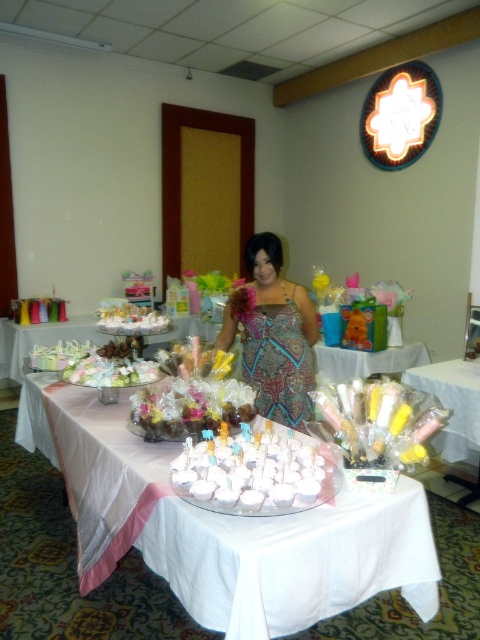
Is white glossy cupcakes at center bigger than matte white cake at center?

Incorrect, white glossy cupcakes at center is not larger than matte white cake at center.

Does white glossy cupcakes at center appear over matte white cake at center?

No.

Is point (272, 426) in front of point (131, 307)?

That is True.

Locate an element on the screen. This screenshot has width=480, height=640. white glossy cupcakes at center is located at coordinates (252, 474).

Does shiny chocolate cake at center have a larger size compared to white glossy flowers at center?

Yes.

Can you confirm if shiny chocolate cake at center is positioned to the left of white glossy flowers at center?

In fact, shiny chocolate cake at center is to the right of white glossy flowers at center.

Is point (206, 419) farther from camera compared to point (86, 380)?

No, (206, 419) is closer to viewer.

You are a GUI agent. You are given a task and a screenshot of the screen. Output one action in this format:
    pyautogui.click(x=<x>, y=<y>)
    Task: Click on the shiny chocolate cake at center
    This screenshot has height=640, width=480.
    Given the screenshot: What is the action you would take?
    pyautogui.click(x=190, y=406)

Who is taller, white paper cupcake at center or white glossy flowers at center?

white paper cupcake at center is taller.

Is white paper cupcake at center bigger than white glossy flowers at center?

Indeed, white paper cupcake at center has a larger size compared to white glossy flowers at center.

You are a GUI agent. You are given a task and a screenshot of the screen. Output one action in this format:
    pyautogui.click(x=<x>, y=<y>)
    Task: Click on the white paper cupcake at center
    
    Given the screenshot: What is the action you would take?
    pyautogui.click(x=224, y=528)